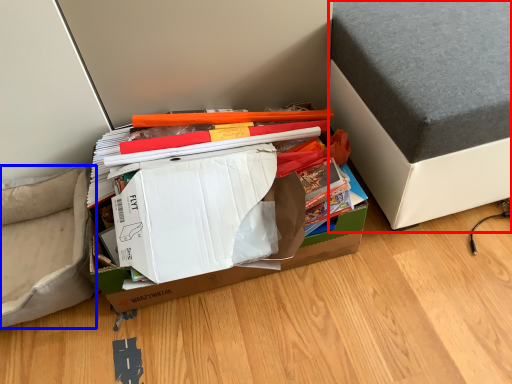
Question: Which object is further to the camera taking this photo, furniture (highlighted by a red box) or armchair (highlighted by a blue box)?

Choices:
 (A) furniture
 (B) armchair

Answer: (B)